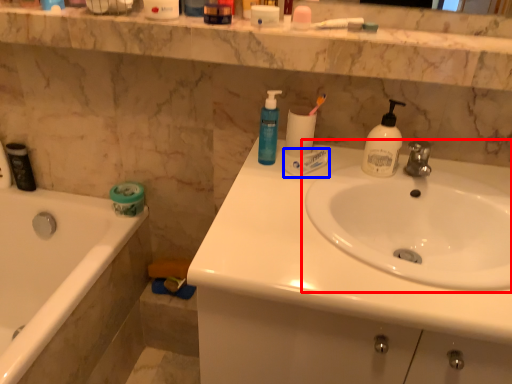
Question: Which of the following is the farthest to the observer, sink (highlighted by a red box) or toothpaste (highlighted by a blue box)?

Choices:
 (A) sink
 (B) toothpaste

Answer: (B)